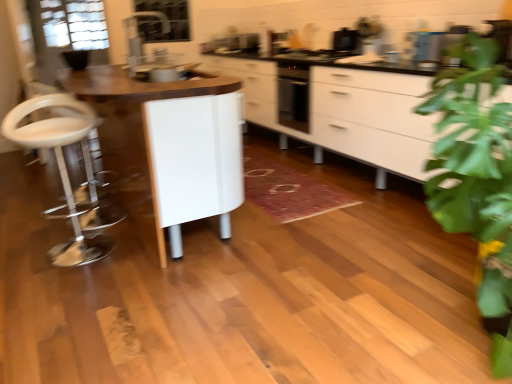
Where is `blank space to the left of white glossy swivel chair at left`? The width and height of the screenshot is (512, 384). blank space to the left of white glossy swivel chair at left is located at coordinates (23, 243).